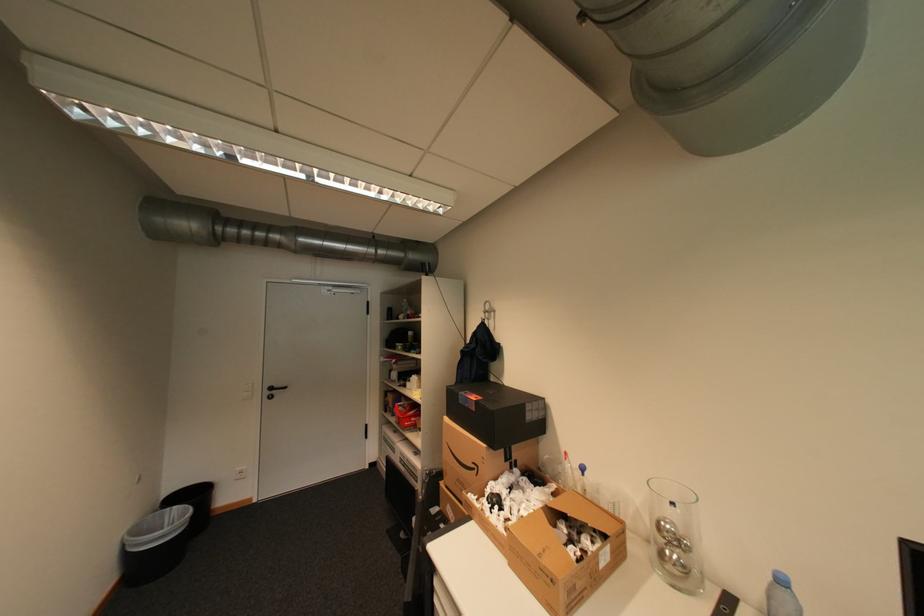
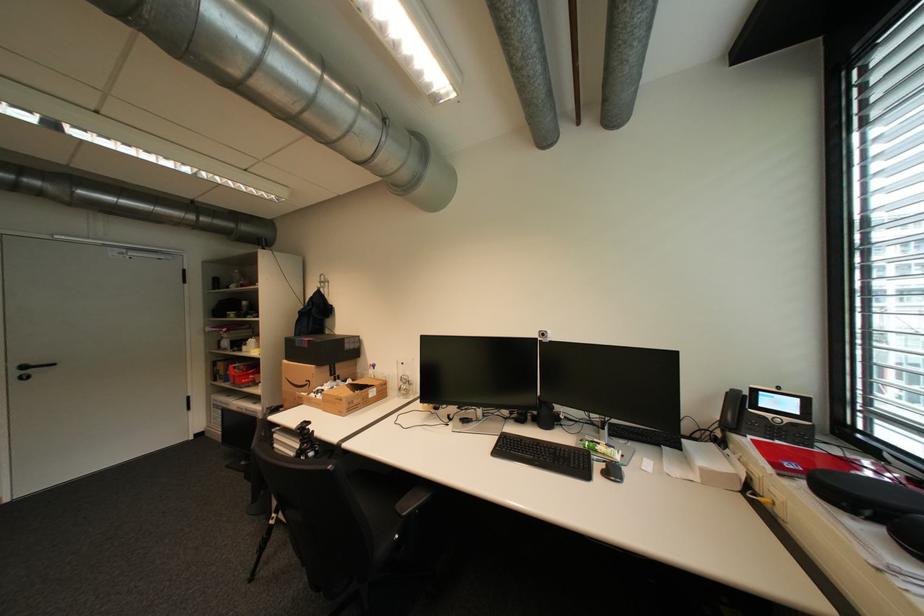
In the second image, find the point that corresponds to pixel 484 468 in the first image.

(317, 383)